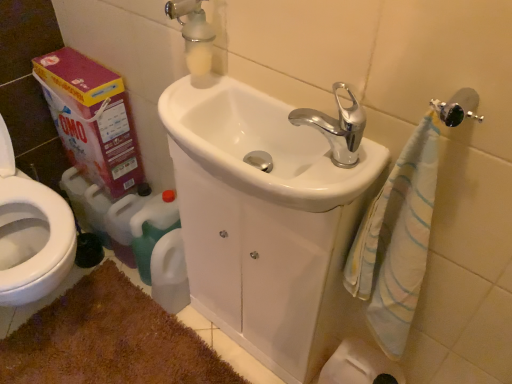
Locate an element on the screen. empty space that is ontop of brown shaggy bath mat at lower left (from a real-world perspective) is located at coordinates (105, 343).